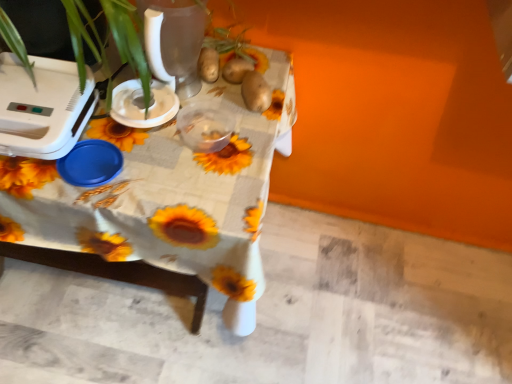
The image size is (512, 384). In order to click on vacant area that is situated to the right of white plastic appliance at left, the first appliance from the left in this screenshot , I will do `click(134, 166)`.